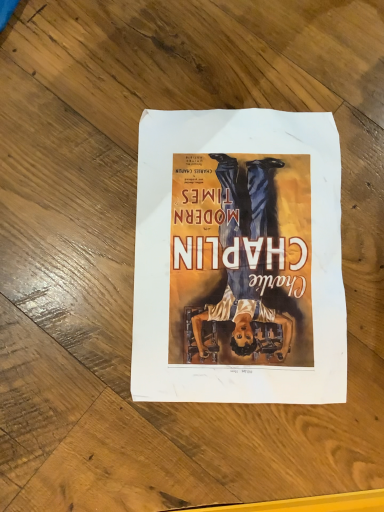
I want to click on vacant area on top of matte paper poster at center (from a real-world perspective), so click(x=238, y=251).